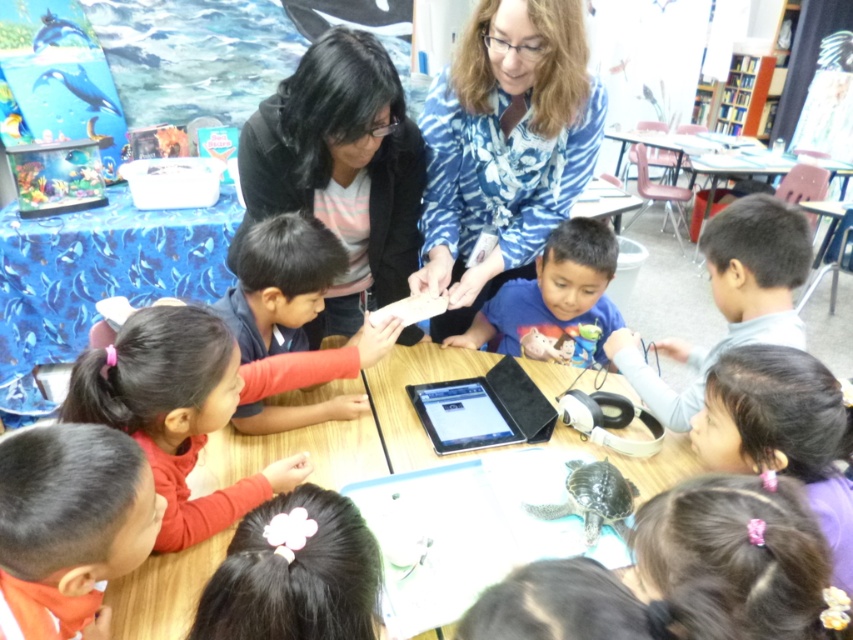
Question: Among these points, which one is farthest from the camera?

Choices:
 (A) (822, 454)
 (B) (728, 611)
 (C) (236, 275)

Answer: (C)

Question: Estimate the real-world distances between objects in this image. Which object is farther from the matte red shirt at lower left?

Choices:
 (A) black hair at lower center
 (B) blue matte shirt at center
 (C) purple hair at lower right
 (D) blue floral shirt at upper center

Answer: (C)

Question: Where is orange fabric shirt at lower left located in relation to red matte shirt at center in the image?

Choices:
 (A) right
 (B) left

Answer: (B)

Question: Considering the relative positions of matte red shirt at lower left and red matte shirt at center in the image provided, where is matte red shirt at lower left located with respect to red matte shirt at center?

Choices:
 (A) above
 (B) below

Answer: (B)

Question: Does blue floral shirt at upper center appear under red matte shirt at center?

Choices:
 (A) yes
 (B) no

Answer: (B)

Question: Which point is farther from the camera taking this photo?

Choices:
 (A) (839, 596)
 (B) (520, 289)
 (C) (267, 307)
 (D) (642, 365)

Answer: (B)